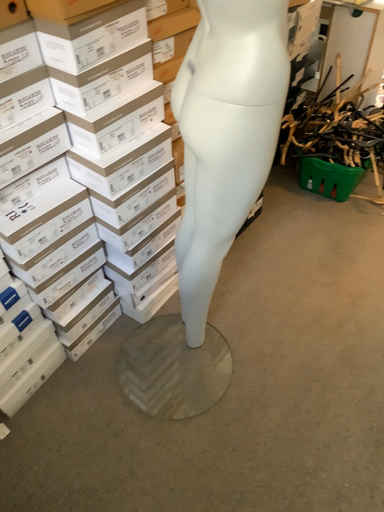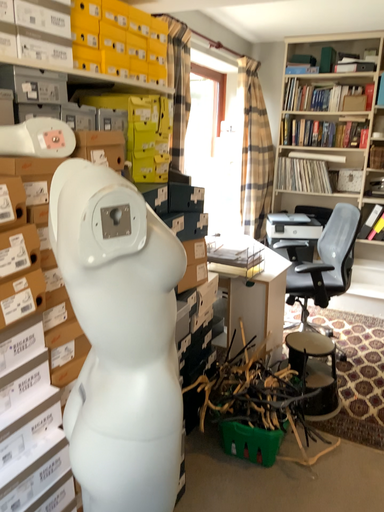
Question: How did the camera likely rotate when shooting the video?

Choices:
 (A) rotated left
 (B) rotated right

Answer: (B)